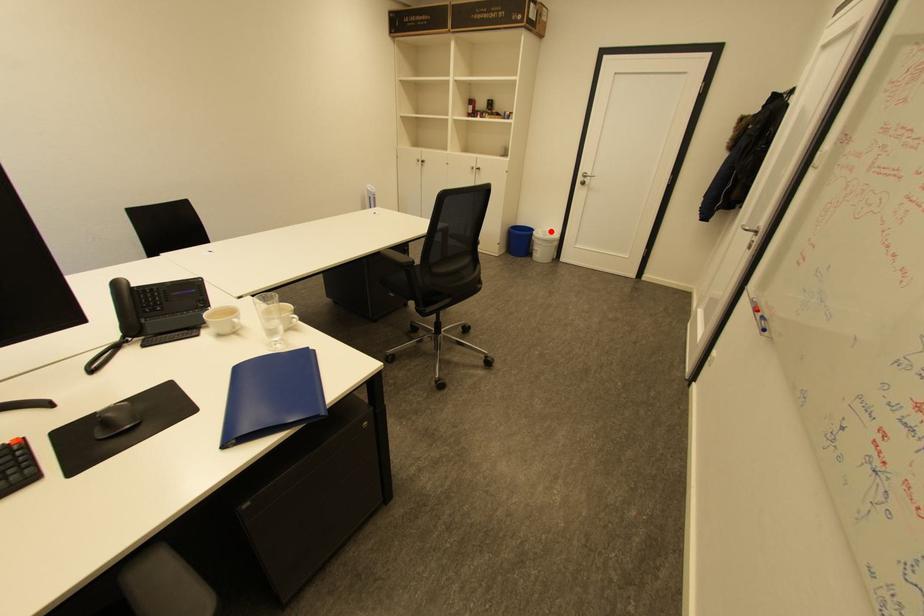
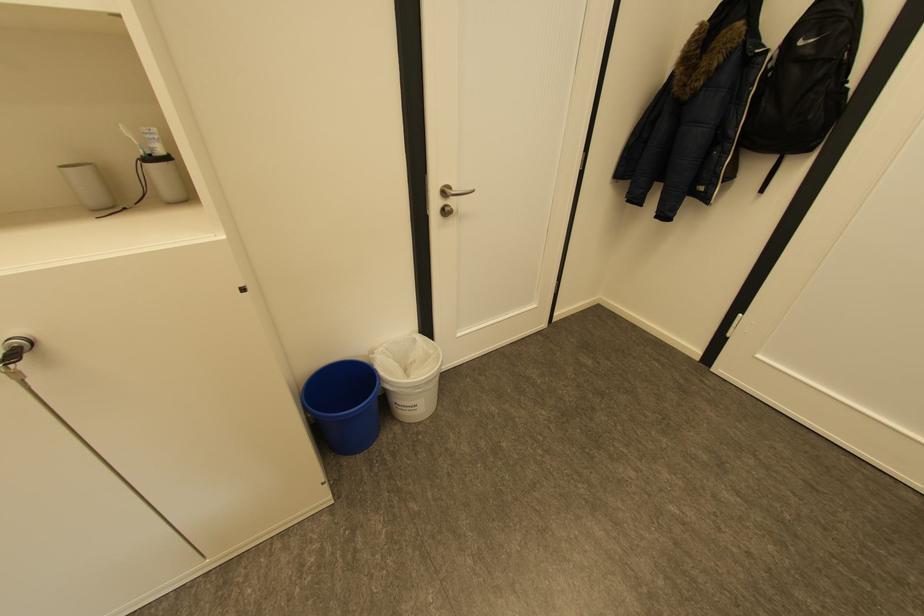
Question: I am providing you with two images of the same scene from different viewpoints. In image1, a red point is highlighted. Considering the same 3D point in image2, which of the following is correct?

Choices:
 (A) It is closer
 (B) It is farther

Answer: (B)